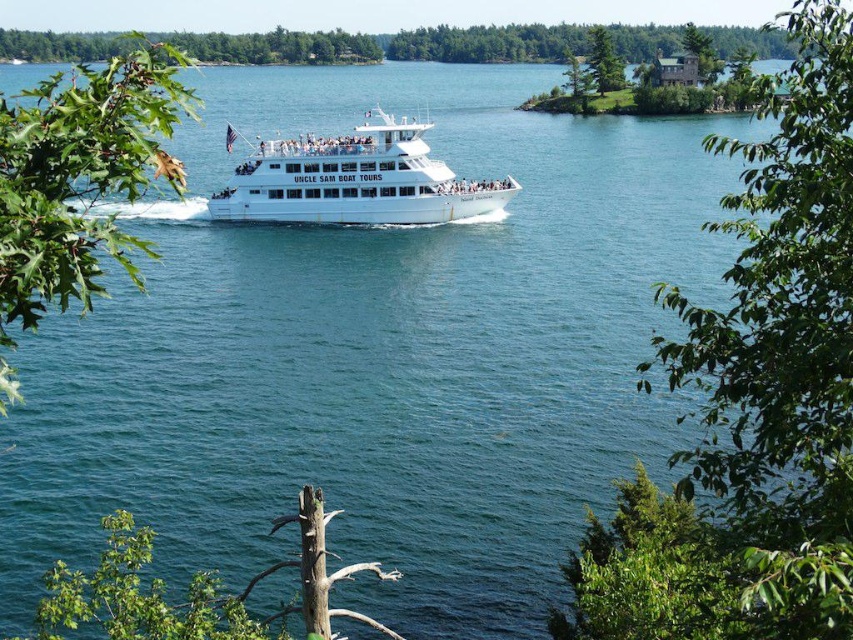
Does green leafy tree at upper right appear under white glossy cruise ship at center?

No, green leafy tree at upper right is not below white glossy cruise ship at center.

The width and height of the screenshot is (853, 640). I want to click on green leafy tree at upper right, so click(x=782, y=349).

Identify the location of green leafy tree at upper right. This screenshot has width=853, height=640. (782, 349).

Measure the distance between green leafy tree at upper right and camera.

15.20 meters

Between point (781, 364) and point (61, 108), which one is positioned behind?

The point (781, 364) is behind.

Which is behind, point (808, 305) or point (71, 177)?

Point (808, 305)

This screenshot has width=853, height=640. I want to click on green leafy tree at upper right, so click(782, 349).

Can you confirm if green leafy tree at upper left is taller than green textured pine tree at upper center?

Yes.

Which is below, green leafy tree at upper left or green textured pine tree at upper center?

green leafy tree at upper left

The image size is (853, 640). Describe the element at coordinates (80, 180) in the screenshot. I see `green leafy tree at upper left` at that location.

Locate an element on the screen. This screenshot has height=640, width=853. green leafy tree at upper left is located at coordinates (80, 180).